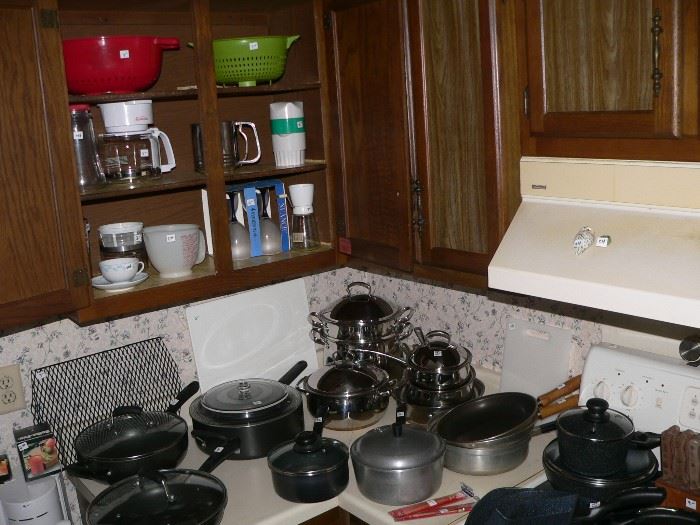
Locate an element on the screen. Image resolution: width=700 pixels, height=525 pixels. colanders is located at coordinates (116, 83), (244, 72).